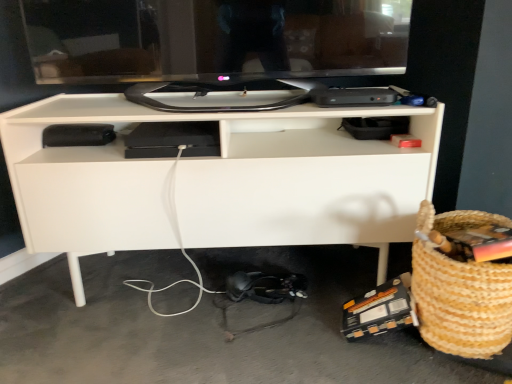
Question: Considering the relative positions of white matte desk at center and braided straw basket at lower right in the image provided, is white matte desk at center to the left of braided straw basket at lower right from the viewer's perspective?

Choices:
 (A) no
 (B) yes

Answer: (B)

Question: Is white matte desk at center thinner than braided straw basket at lower right?

Choices:
 (A) no
 (B) yes

Answer: (A)

Question: Does white matte desk at center have a larger size compared to braided straw basket at lower right?

Choices:
 (A) yes
 (B) no

Answer: (A)

Question: Does white matte desk at center touch braided straw basket at lower right?

Choices:
 (A) no
 (B) yes

Answer: (A)

Question: Does white matte desk at center lie in front of braided straw basket at lower right?

Choices:
 (A) yes
 (B) no

Answer: (B)

Question: From a real-world perspective, is white matte desk at center under braided straw basket at lower right?

Choices:
 (A) yes
 (B) no

Answer: (B)

Question: Is braided straw basket at lower right in front of white matte desk at center?

Choices:
 (A) no
 (B) yes

Answer: (B)

Question: Is braided straw basket at lower right not close to white matte desk at center?

Choices:
 (A) yes
 (B) no

Answer: (B)

Question: Is braided straw basket at lower right wider than white matte desk at center?

Choices:
 (A) yes
 (B) no

Answer: (B)

Question: Is braided straw basket at lower right next to white matte desk at center and touching it?

Choices:
 (A) no
 (B) yes

Answer: (A)

Question: Is braided straw basket at lower right oriented away from white matte desk at center?

Choices:
 (A) yes
 (B) no

Answer: (B)

Question: From the image's perspective, would you say braided straw basket at lower right is positioned over white matte desk at center?

Choices:
 (A) no
 (B) yes

Answer: (A)

Question: Is black glossy monitor at upper center surrounding white matte desk at center?

Choices:
 (A) no
 (B) yes

Answer: (A)